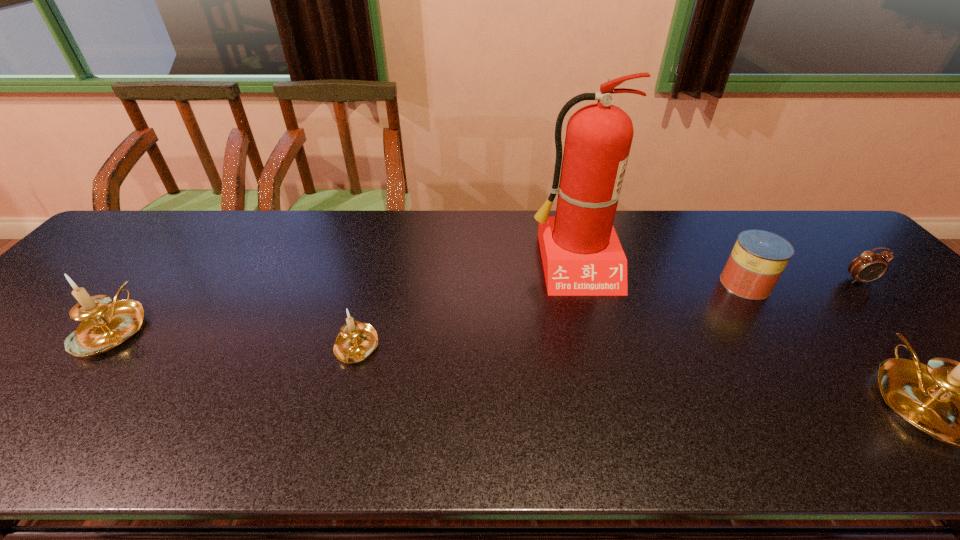
Find the location of a particular element. the third tallest object is located at coordinates (105, 325).

Image resolution: width=960 pixels, height=540 pixels. Identify the location of the leftmost object. (105, 325).

I want to click on the shortest candle holder, so click(x=356, y=341).

You are a GUI agent. You are given a task and a screenshot of the screen. Output one action in this format:
    pyautogui.click(x=<x>, y=<y>)
    Task: Click on the second object from left to right
    This screenshot has width=960, height=540.
    Given the screenshot: What is the action you would take?
    pyautogui.click(x=356, y=341)

You are a GUI agent. You are given a task and a screenshot of the screen. Output one action in this format:
    pyautogui.click(x=<x>, y=<y>)
    Task: Click on the can
    This screenshot has height=540, width=960.
    Given the screenshot: What is the action you would take?
    pyautogui.click(x=758, y=258)

In order to click on the tallest object in this screenshot , I will do `click(581, 254)`.

This screenshot has width=960, height=540. I want to click on the fourth object from right to left, so [x=581, y=254].

Find the location of a particular element. This screenshot has height=540, width=960. alarm clock is located at coordinates (869, 266).

The height and width of the screenshot is (540, 960). In order to click on vacant space located 0.160m on the handle side of the third tallest object in this screenshot , I will do `click(171, 259)`.

You are a GUI agent. You are given a task and a screenshot of the screen. Output one action in this format:
    pyautogui.click(x=<x>, y=<y>)
    Task: Click on the free space located on the handle side of the third tallest object
    
    Given the screenshot: What is the action you would take?
    pyautogui.click(x=180, y=248)